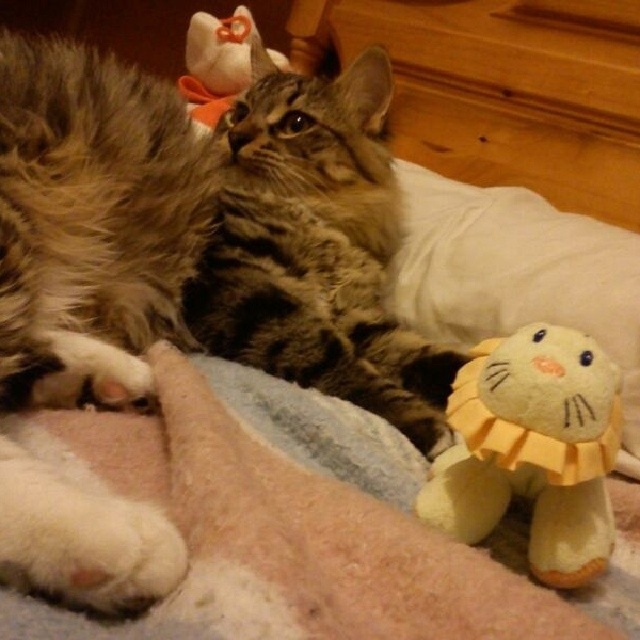
You are a cat owner trying to locate your two cats in the living room. You see a fuzzy brown cat at center and a fuzzy brown tabby cat at center. Which one is positioned lower in the image?

The fuzzy brown cat at center is positioned lower than the fuzzy brown tabby cat at center according to the description.

You are a cat owner who wants to place a new toy for your cat. You have a yellow plush toy at lower right and a soft blue fabric at lower center. Which object is located to the right of the other?

The yellow plush toy at lower right is positioned on the right side of soft blue fabric at lower center.

You are a cat owner who wants to place a new toy for your cat. You have a new yellow plush toy at lower right and a soft blue fabric at lower center. Based on their positions, which object is closer to the cat?

The yellow plush toy at lower right is in front of the soft blue fabric at lower center, so it is closer to the cat.